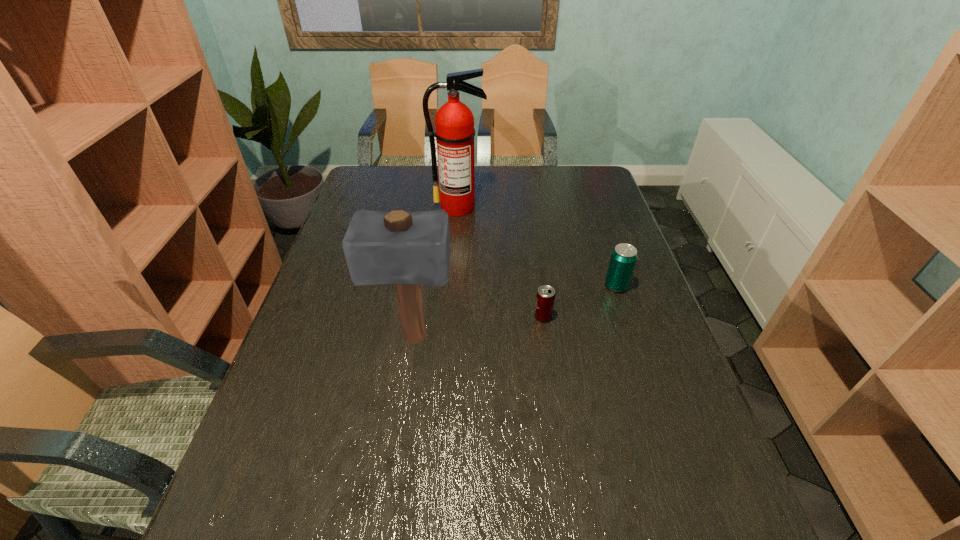
Where is `free space between the nearer beer can and the tallest object`? free space between the nearer beer can and the tallest object is located at coordinates pos(501,262).

What are the coordinates of `vacant point located between the third tallest object and the nearer beer can` in the screenshot? It's located at (580, 301).

What are the coordinates of `free space between the third shortest object and the right beer can` in the screenshot? It's located at (516, 312).

This screenshot has width=960, height=540. Find the location of `vacant space that is in between the nearer beer can and the farthest object`. vacant space that is in between the nearer beer can and the farthest object is located at coordinates (501, 262).

Locate an element on the screen. free space between the third object from left to right and the third shortest object is located at coordinates (478, 327).

Find the location of `empty space that is in between the tallest object and the rightmost object`. empty space that is in between the tallest object and the rightmost object is located at coordinates (538, 247).

Identify which object is the nearest to the third object from left to right. Please provide its 2D coordinates. Your answer should be formatted as a tuple, i.e. [(x, y)], where the tuple contains the x and y coordinates of a point satisfying the conditions above.

[(623, 259)]

Locate which object ranks in proximity to the mallet. Please provide its 2D coordinates. Your answer should be formatted as a tuple, i.e. [(x, y)], where the tuple contains the x and y coordinates of a point satisfying the conditions above.

[(545, 298)]

Image resolution: width=960 pixels, height=540 pixels. Identify the location of free location that satisfies the following two spatial constraints: 1. on the side of the farthest object near the handle; 2. on the right side of the rightmost object. (453, 286).

Where is `vacant region that satisfies the following two spatial constraints: 1. on the back side of the mallet; 2. on the right side of the third tallest object`? The width and height of the screenshot is (960, 540). vacant region that satisfies the following two spatial constraints: 1. on the back side of the mallet; 2. on the right side of the third tallest object is located at coordinates (421, 286).